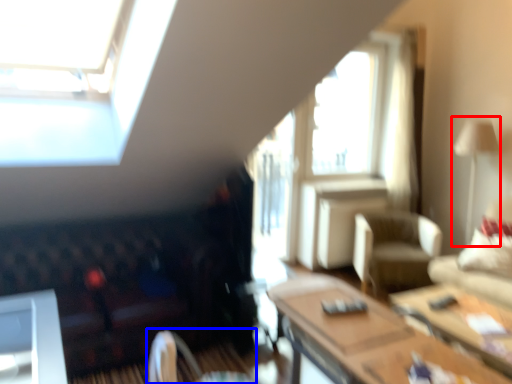
Question: Which object is further to the camera taking this photo, lamp (highlighted by a red box) or swivel chair (highlighted by a blue box)?

Choices:
 (A) lamp
 (B) swivel chair

Answer: (A)